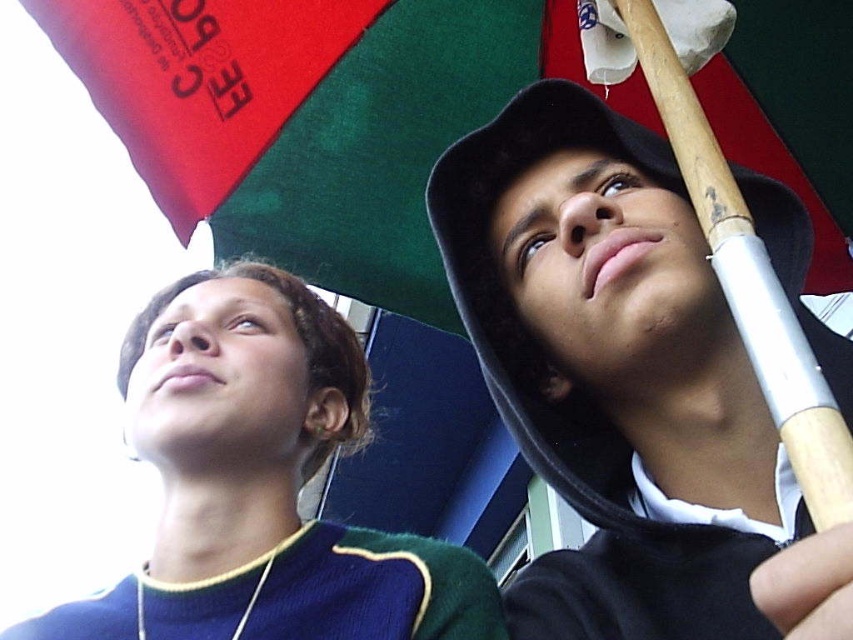
You are standing at the base of the wooden pole and see the black matte baseball cap at upper center and the dark blue sweater at upper left. Which object is positioned to the right of the other?

The black matte baseball cap at upper center is to the right of the dark blue sweater at upper left.

You are standing at the bottom of the image and looking up. There is a point at coordinates (625, 385). What object is located at that point?

The black matte baseball cap at upper center is located at point (625, 385).